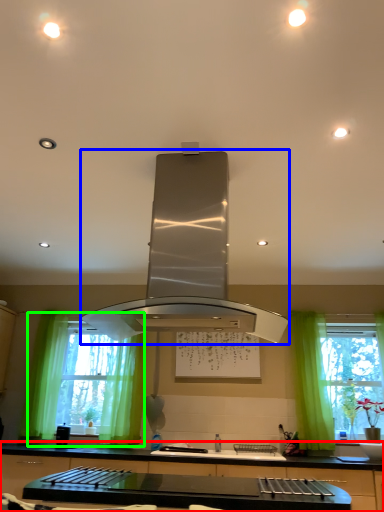
Question: Which object is positioned closest to countertop (highlighted by a red box)? Select from home appliance (highlighted by a blue box) and window (highlighted by a green box).

Choices:
 (A) home appliance
 (B) window

Answer: (B)